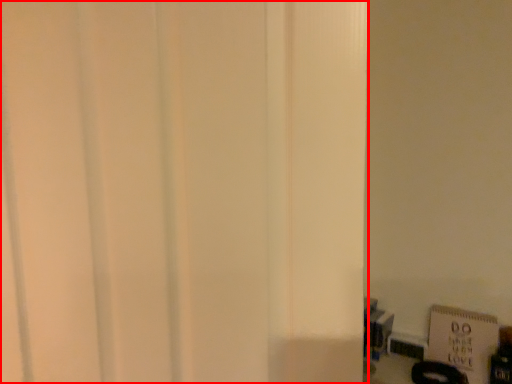
Question: Where is door (annotated by the red box) located in relation to bulletin board in the image?

Choices:
 (A) left
 (B) right

Answer: (A)